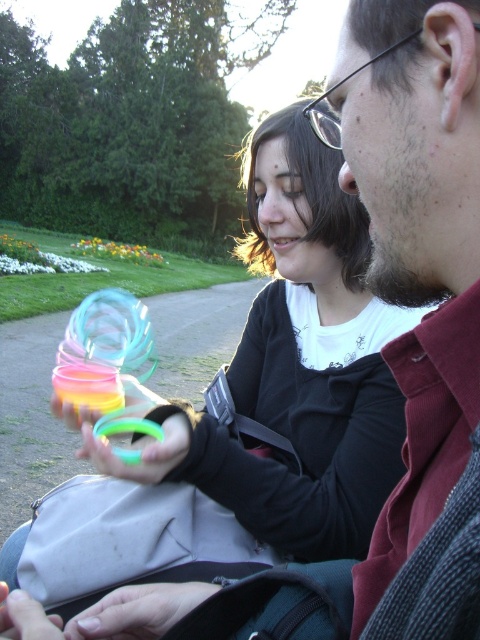
Question: Does dark red shirt at right come behind matte black hand at lower left?

Choices:
 (A) no
 (B) yes

Answer: (A)

Question: Which object appears closest to the camera in this image?

Choices:
 (A) dark red shirt at right
 (B) neon rubber bracelet at center

Answer: (A)

Question: Can you confirm if dark red shirt at right is positioned below matte plastic ring at lower center?

Choices:
 (A) no
 (B) yes

Answer: (A)

Question: Which point is closer to the camera?

Choices:
 (A) (384, 212)
 (B) (86, 637)
 (C) (44, 611)

Answer: (C)

Question: Is dark red shirt at right wider than matte plastic ring at lower center?

Choices:
 (A) no
 (B) yes

Answer: (A)

Question: Which object is the farthest from the matte plastic ring at lower center?

Choices:
 (A) matte black hand at lower left
 (B) neon rubber bracelet at center
 (C) dark red shirt at right

Answer: (C)